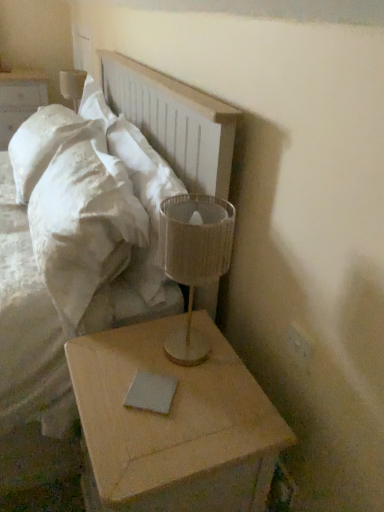
Question: In terms of width, does white soft pillow at upper left look wider or thinner when compared to light wood/roughnightstand at lower right, which is the second nightstand from back to front?

Choices:
 (A) thin
 (B) wide

Answer: (A)

Question: From a real-world perspective, is white soft pillow at upper left above or below light wood/roughnightstand at lower right, which is the first nightstand from bottom to top?

Choices:
 (A) above
 (B) below

Answer: (A)

Question: Which object is positioned closest to the gray matte notepad at lower center?

Choices:
 (A) white matte nightstand at upper left, which is counted as the first nightstand, starting from the top
 (B) light wood/roughnightstand at lower right, the 1th nightstand viewed from the front
 (C) translucent fabric lampshade at right, which is counted as the 2th table lamp, starting from the back
 (D) white soft pillow at upper left
 (E) white plastic electric outlet at upper right

Answer: (B)

Question: Estimate the real-world distances between objects in this image. Which object is farther from the gray matte notepad at lower center?

Choices:
 (A) white matte nightstand at upper left, the 1th nightstand positioned from the left
 (B) white fabric bed at upper left
 (C) light wood/roughnightstand at lower right, the second nightstand in the top-to-bottom sequence
 (D) white soft pillow at upper left
 (E) white plastic electric outlet at upper right

Answer: (A)